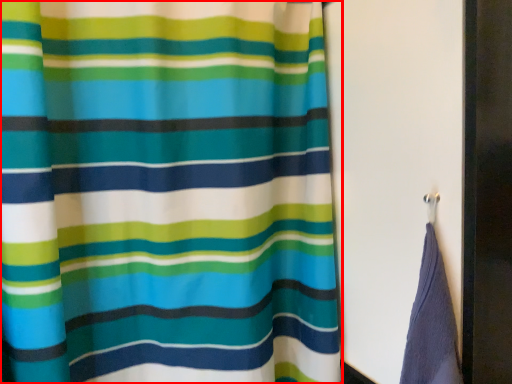
Question: From the image's perspective, where is curtain (annotated by the red box) located in relation to screen door in the image?

Choices:
 (A) below
 (B) above

Answer: (A)